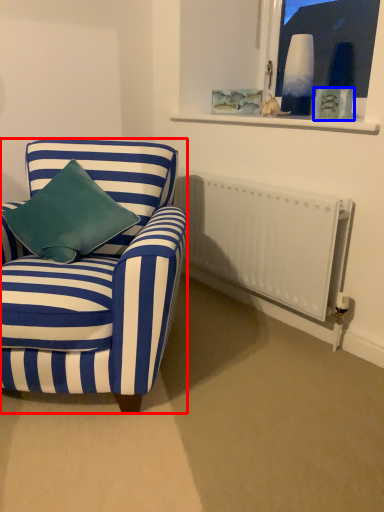
Question: Among these objects, which one is nearest to the camera, chair (highlighted by a red box) or picture frame (highlighted by a blue box)?

Choices:
 (A) chair
 (B) picture frame

Answer: (A)